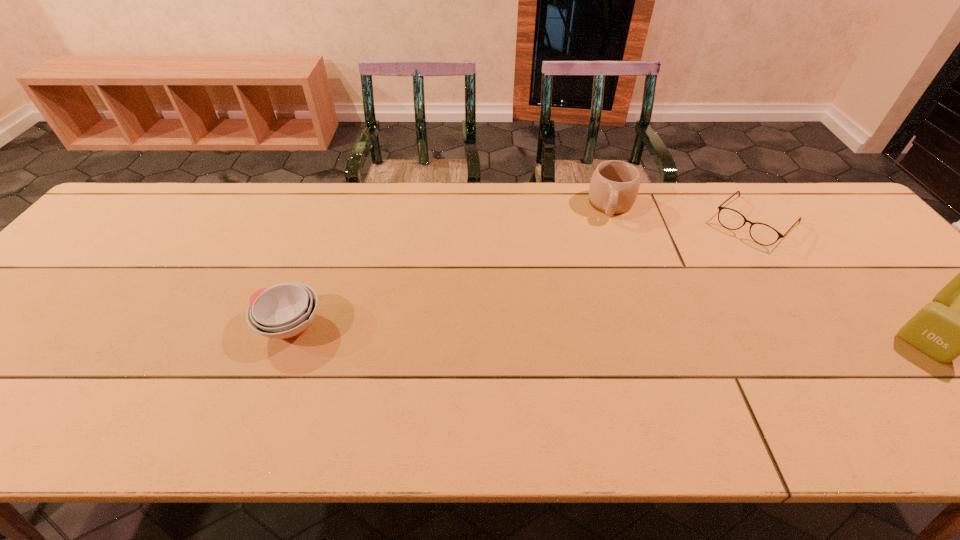
What are the coordinates of `the leftmost object` in the screenshot? It's located at pos(284,311).

Identify the location of the second object from left to right. The image size is (960, 540). (614, 186).

Locate an element on the screen. The image size is (960, 540). the shortest object is located at coordinates (763, 234).

The height and width of the screenshot is (540, 960). Identify the location of spectacles. (763, 234).

Image resolution: width=960 pixels, height=540 pixels. I want to click on free space located 0.310m on the back of the leftmost object, so click(x=329, y=220).

Find the location of a particular element. This screenshot has width=960, height=540. vacant space positioned on the side of the mug with the handle is located at coordinates (x=607, y=255).

At what (x,y) coordinates should I click in order to perform the action: click on vacant area located on the side of the mug with the handle. Please return your answer as a coordinate pair (x, y). The height and width of the screenshot is (540, 960). Looking at the image, I should click on (600, 313).

Where is `vacant space located on the side of the mug with the handle`? vacant space located on the side of the mug with the handle is located at coordinates (604, 284).

Locate an element on the screen. The height and width of the screenshot is (540, 960). free space located on the front-facing side of the shortest object is located at coordinates (663, 315).

What are the coordinates of `free space located 0.120m on the front-facing side of the shortest object` in the screenshot? It's located at (715, 262).